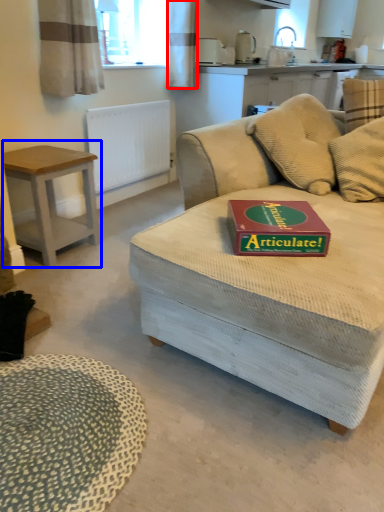
Question: Among these objects, which one is farthest to the camera, curtain (highlighted by a red box) or table (highlighted by a blue box)?

Choices:
 (A) curtain
 (B) table

Answer: (A)